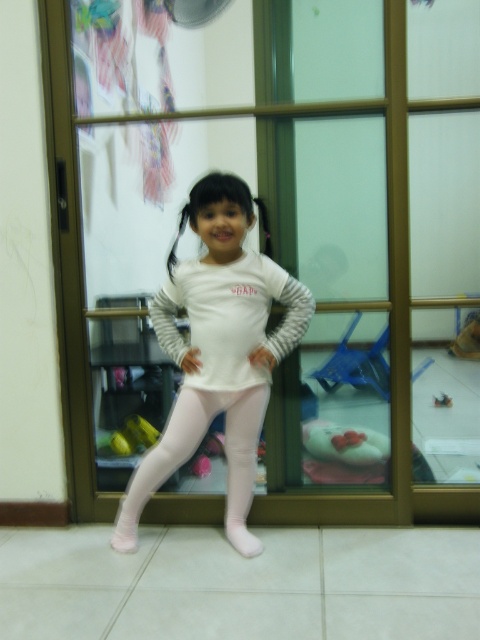
Question: Is white striped sweatshirt at center bigger than pink smooth leggings at center?

Choices:
 (A) yes
 (B) no

Answer: (B)

Question: Which object is farther from the camera taking this photo?

Choices:
 (A) white striped sweatshirt at center
 (B) pink smooth leggings at center
 (C) white matte leggings at center

Answer: (B)

Question: Does white matte leggings at center have a greater width compared to white striped sweatshirt at center?

Choices:
 (A) yes
 (B) no

Answer: (A)

Question: Which object is the farthest from the white matte leggings at center?

Choices:
 (A) pink smooth leggings at center
 (B) white striped sweatshirt at center

Answer: (A)

Question: Estimate the real-world distances between objects in this image. Which object is closer to the pink smooth leggings at center?

Choices:
 (A) white striped sweatshirt at center
 (B) white matte leggings at center

Answer: (B)

Question: Considering the relative positions of white matte leggings at center and white striped sweatshirt at center in the image provided, where is white matte leggings at center located with respect to white striped sweatshirt at center?

Choices:
 (A) below
 (B) above

Answer: (A)